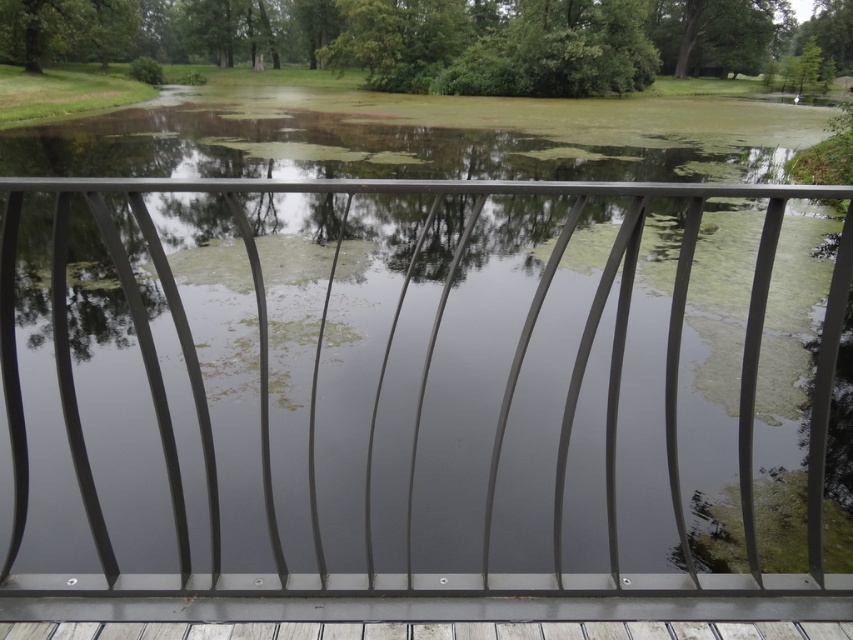
You are standing behind the metal railing and looking at the two green leafy trees in the background. Which tree is closer to you, the green leafy tree at upper center or the green leafy tree at upper left?

The green leafy tree at upper center is closer to you because it is further to the viewer than the green leafy tree at upper left.

You are standing behind the metal railing and looking at the two green leafy trees in the background. Which tree, the green leafy tree at upper center or the green leafy tree at upper left, appears taller in the image?

The green leafy tree at upper center appears taller than the green leafy tree at upper left in the image.